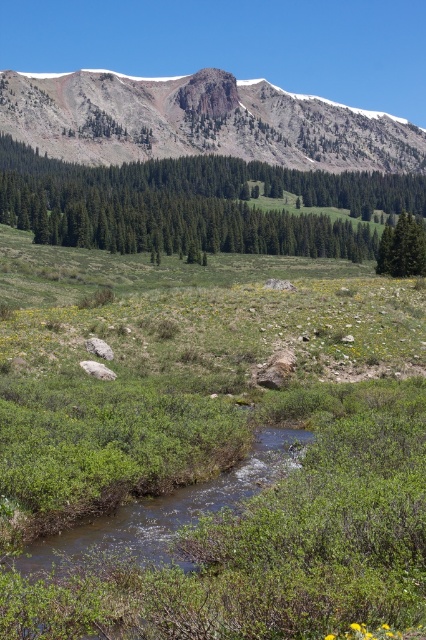
Is rusty rock mountain at upper center above green matte tree at right?

Yes, rusty rock mountain at upper center is above green matte tree at right.

Between point (161, 104) and point (411, 225), which one is positioned behind?

Positioned behind is point (161, 104).

Find the location of `rusty rock mountain at upper center`. rusty rock mountain at upper center is located at coordinates (199, 122).

At what (x,y) coordinates should I click in order to perform the action: click on rusty rock mountain at upper center. Please return your answer as a coordinate pair (x, y). This screenshot has width=426, height=640. Looking at the image, I should click on (199, 122).

Does green textured tree at center appear on the left side of rusty rock mountain at upper center?

Indeed, green textured tree at center is positioned on the left side of rusty rock mountain at upper center.

You are a GUI agent. You are given a task and a screenshot of the screen. Output one action in this format:
    pyautogui.click(x=<x>, y=<y>)
    Task: Click on the green textured tree at center
    
    Given the screenshot: What is the action you would take?
    pyautogui.click(x=193, y=204)

Does point (393, 202) lie behind point (319, 148)?

That is False.

Locate an element on the screen. green textured tree at center is located at coordinates (193, 204).

Does green textured tree at center have a lesser width compared to green matte tree at right?

No, green textured tree at center is not thinner than green matte tree at right.

Who is taller, green textured tree at center or green matte tree at right?

Standing taller between the two is green textured tree at center.

The width and height of the screenshot is (426, 640). Describe the element at coordinates (193, 204) in the screenshot. I see `green textured tree at center` at that location.

This screenshot has width=426, height=640. What are the coordinates of `green textured tree at center` in the screenshot? It's located at (193, 204).